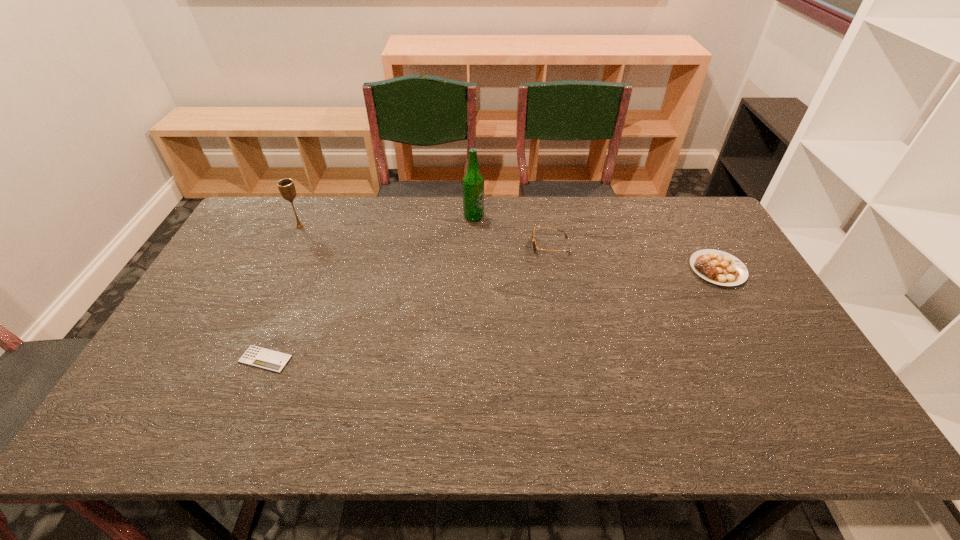
In the image, there is a desktop. Identify the location of vacant area at the far edge. Image resolution: width=960 pixels, height=540 pixels. (448, 219).

The width and height of the screenshot is (960, 540). What are the coordinates of `free region at the near edge of the desktop` in the screenshot? It's located at (652, 415).

Where is `vacant space at the left edge`? vacant space at the left edge is located at coordinates (185, 400).

Locate an element on the screen. Image resolution: width=960 pixels, height=540 pixels. vacant space at the right edge of the desktop is located at coordinates (776, 377).

Where is `free region at the far right corner of the desktop`? This screenshot has height=540, width=960. free region at the far right corner of the desktop is located at coordinates (697, 197).

Locate an element on the screen. free area in between the chalice and the fourth tallest object is located at coordinates (509, 248).

The width and height of the screenshot is (960, 540). I want to click on vacant region between the nearest object and the chalice, so click(x=282, y=293).

The height and width of the screenshot is (540, 960). In order to click on free area in between the fourth object from left to right and the nearest object in this screenshot , I will do click(x=408, y=303).

Where is `vacant point located between the third object from right to left and the nearest object`? vacant point located between the third object from right to left and the nearest object is located at coordinates point(370,288).

Locate an element on the screen. The width and height of the screenshot is (960, 540). free space between the shortest object and the beer bottle is located at coordinates (370, 288).